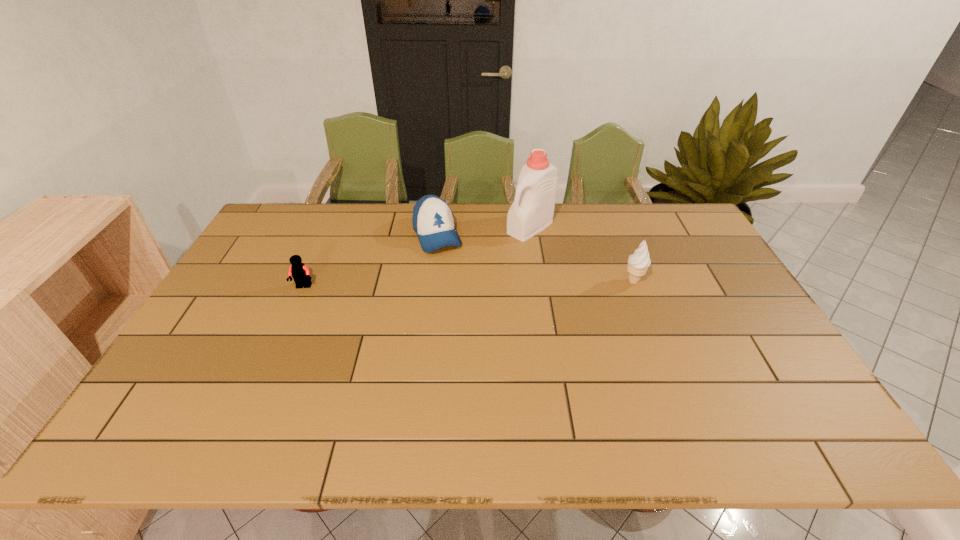
You are a GUI agent. You are given a task and a screenshot of the screen. Output one action in this format:
    pyautogui.click(x=<x>, y=<y>)
    Task: Click on the vacant position located on the handle side of the detergent
    This screenshot has height=540, width=960.
    Given the screenshot: What is the action you would take?
    pyautogui.click(x=430, y=296)

Identify the location of free space located 0.240m on the handle side of the detergent. The image size is (960, 540). (466, 272).

Where is `vacant space located 0.380m on the handle side of the detergent`? vacant space located 0.380m on the handle side of the detergent is located at coordinates (433, 294).

At what (x,y) coordinates should I click in order to perform the action: click on vacant space located 0.280m on the front-facing side of the second object from left to right. Please return your answer as a coordinate pair (x, y). This screenshot has height=540, width=960. Looking at the image, I should click on (472, 314).

I want to click on vacant space situated 0.220m on the front-facing side of the second object from left to right, so click(x=466, y=300).

Find the location of a particular element. vacant space located 0.200m on the front-facing side of the second object from left to right is located at coordinates (463, 296).

You are a GUI agent. You are given a task and a screenshot of the screen. Output one action in this format:
    pyautogui.click(x=<x>, y=<y>)
    Task: Click on the detergent that is at the far edge
    The image size is (960, 540).
    Given the screenshot: What is the action you would take?
    pyautogui.click(x=532, y=211)

Locate an element on the screen. baseball cap at the far edge is located at coordinates (433, 221).

Locate an element on the screen. Image resolution: width=960 pixels, height=540 pixels. free region at the far edge of the desktop is located at coordinates (310, 228).

This screenshot has height=540, width=960. Find the location of `vacant space at the near edge of the desktop`. vacant space at the near edge of the desktop is located at coordinates (344, 395).